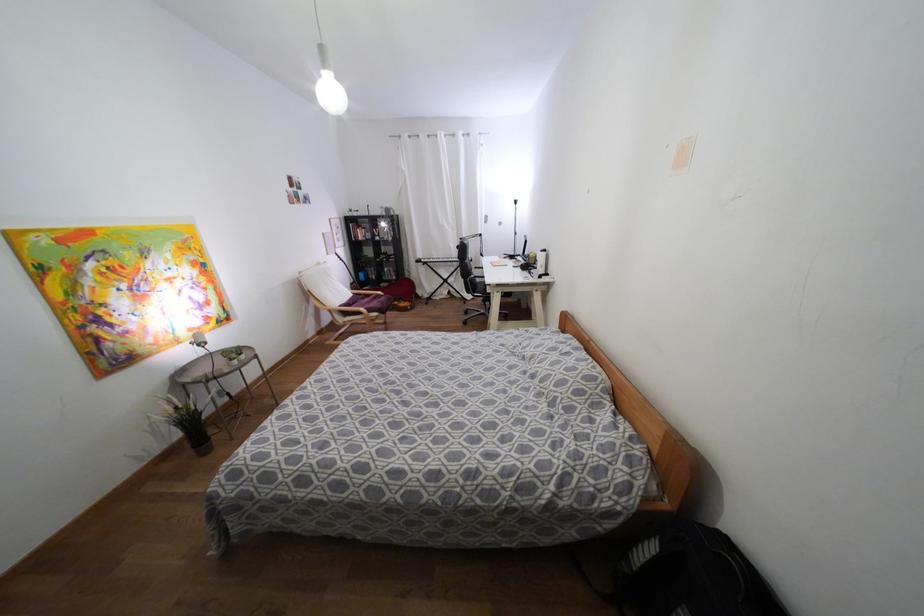
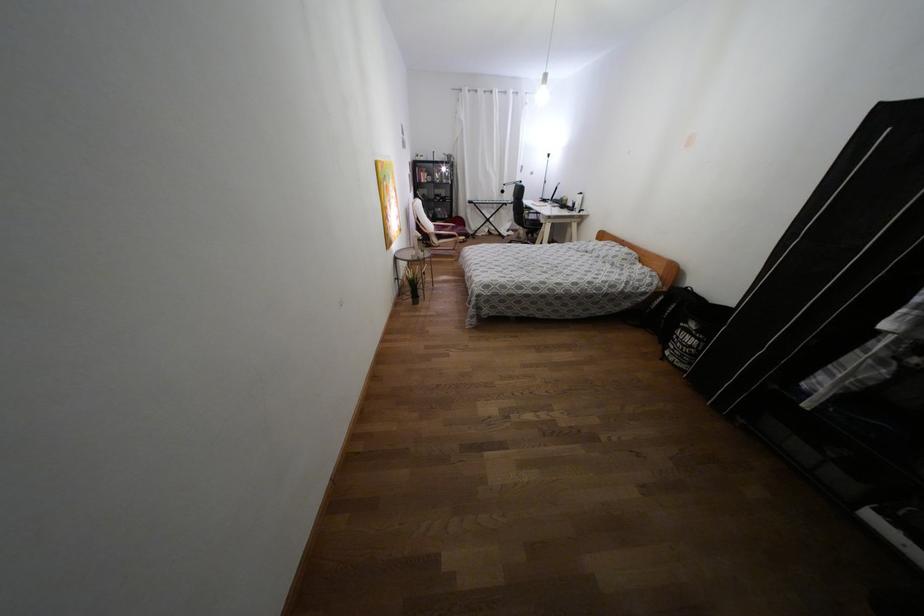
Where in the second image is the point corresponding to point 344,313 from the first image?

(439, 237)